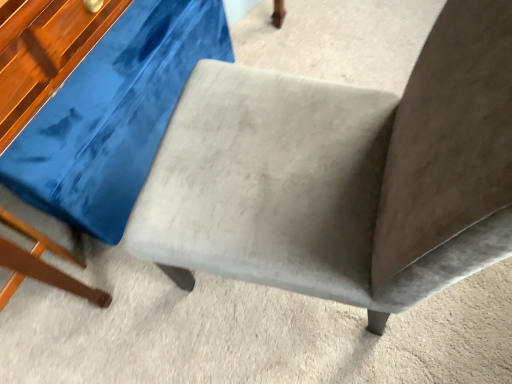
Question: Based on their positions, is suede-like gray chair at center located to the left or right of suede gray swivel chair at center?

Choices:
 (A) left
 (B) right

Answer: (B)

Question: Considering the positions of suede-like gray chair at center and suede gray swivel chair at center in the image, is suede-like gray chair at center taller or shorter than suede gray swivel chair at center?

Choices:
 (A) tall
 (B) short

Answer: (A)

Question: Choose the correct answer: Is suede-like gray chair at center inside suede gray swivel chair at center or outside it?

Choices:
 (A) outside
 (B) inside

Answer: (A)

Question: In terms of width, does suede gray swivel chair at center look wider or thinner when compared to suede-like gray chair at center?

Choices:
 (A) wide
 (B) thin

Answer: (A)

Question: Looking at the image, does suede gray swivel chair at center seem bigger or smaller compared to suede-like gray chair at center?

Choices:
 (A) big
 (B) small

Answer: (B)

Question: In the image, is suede gray swivel chair at center on the left side or the right side of suede-like gray chair at center?

Choices:
 (A) right
 (B) left

Answer: (B)

Question: Is suede gray swivel chair at center inside the boundaries of suede-like gray chair at center, or outside?

Choices:
 (A) outside
 (B) inside

Answer: (A)